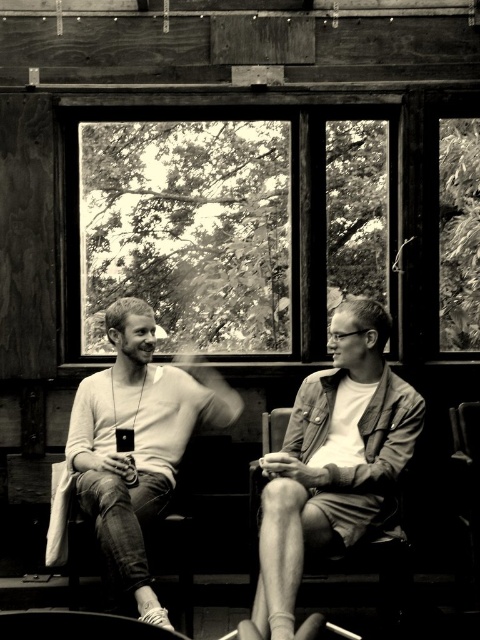
Between wooden frame window at upper center and smooth white sweater at center, which one appears on the left side from the viewer's perspective?

smooth white sweater at center

Identify the location of wooden frame window at upper center. The height and width of the screenshot is (640, 480). (230, 225).

Who is more distant from viewer, (368, 419) or (90, 500)?

Positioned behind is point (368, 419).

Image resolution: width=480 pixels, height=640 pixels. I want to click on matte brown leather jacket at center, so click(x=334, y=460).

Can you confirm if wooden frame window at upper center is positioned to the left of matte brown leather jacket at center?

Yes, wooden frame window at upper center is to the left of matte brown leather jacket at center.

Between point (287, 342) and point (317, 531), which one is positioned in front?

Point (317, 531)

I want to click on wooden frame window at upper center, so click(x=230, y=225).

Find the location of `wooden frame window at upper center`. wooden frame window at upper center is located at coordinates (230, 225).